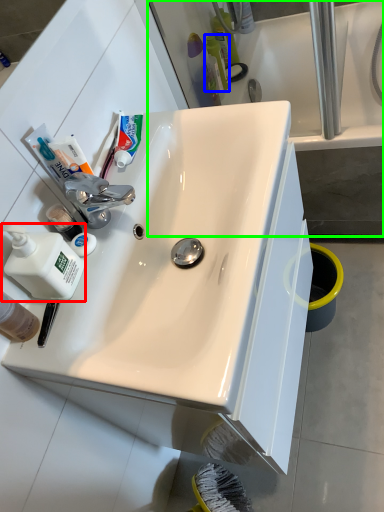
Question: Which object is positioned farthest from cleaning product (highlighted by a red box)? Select from toiletry (highlighted by a blue box) and bath (highlighted by a green box).

Choices:
 (A) toiletry
 (B) bath

Answer: (A)